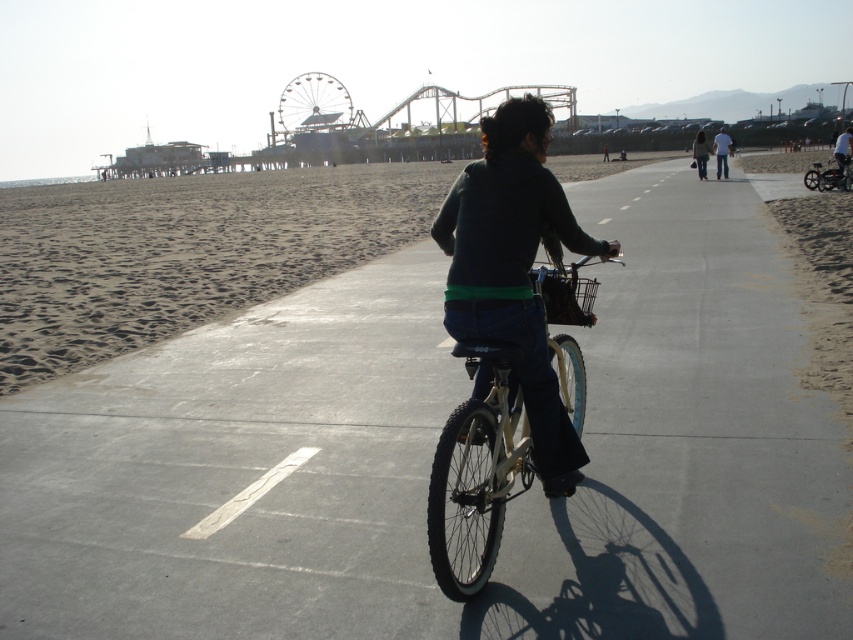
Who is taller, light blue jeans at center or dark blue jeans at center?

Standing taller between the two is light blue jeans at center.

Who is more forward, (726, 163) or (607, 157)?

Point (726, 163)

You are a GUI agent. You are given a task and a screenshot of the screen. Output one action in this format:
    pyautogui.click(x=<x>, y=<y>)
    Task: Click on the light blue jeans at center
    The height and width of the screenshot is (640, 853).
    Given the screenshot: What is the action you would take?
    pyautogui.click(x=722, y=150)

Does shiny metallic bicycle at right appear on the left side of white fabric shirt at center?

Yes, shiny metallic bicycle at right is to the left of white fabric shirt at center.

Describe the element at coordinates (828, 176) in the screenshot. Image resolution: width=853 pixels, height=640 pixels. I see `shiny metallic bicycle at right` at that location.

Is point (815, 177) positioned behind point (842, 164)?

No, it is in front of (842, 164).

Where is `shiny metallic bicycle at right`? shiny metallic bicycle at right is located at coordinates (828, 176).

Can you confirm if shiny metallic bicycle at center is positioned to the right of denim pants at center?

Incorrect, shiny metallic bicycle at center is not on the right side of denim pants at center.

Is shiny metallic bicycle at center closer to camera compared to denim pants at center?

Yes, it is in front of denim pants at center.

Where is `shiny metallic bicycle at center`? shiny metallic bicycle at center is located at coordinates (477, 474).

Find the location of a particular element. This screenshot has height=640, width=853. shiny metallic bicycle at center is located at coordinates (477, 474).